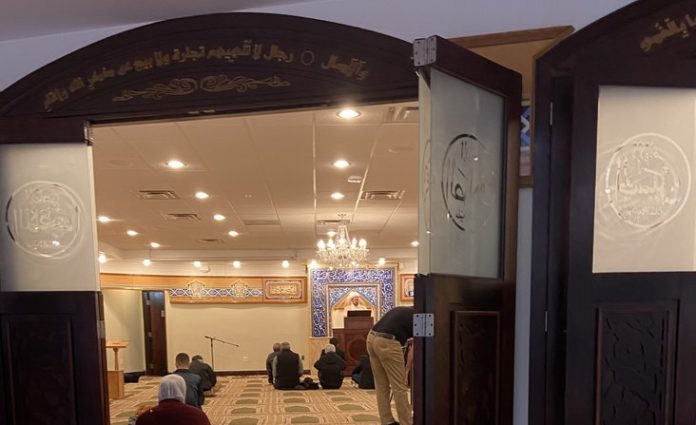
The height and width of the screenshot is (425, 696). What are the coordinates of `door latch` in the screenshot? It's located at (420, 328).